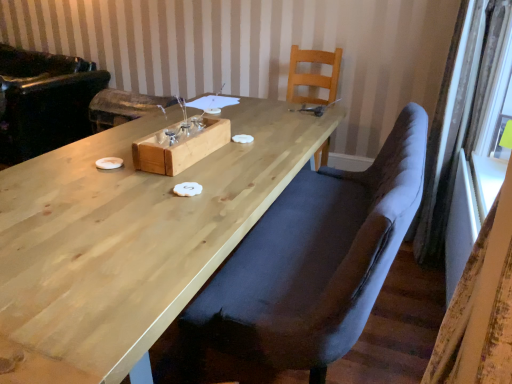
What are the coordinates of `free space in front of natural wood tray at center` in the screenshot? It's located at pyautogui.click(x=173, y=188).